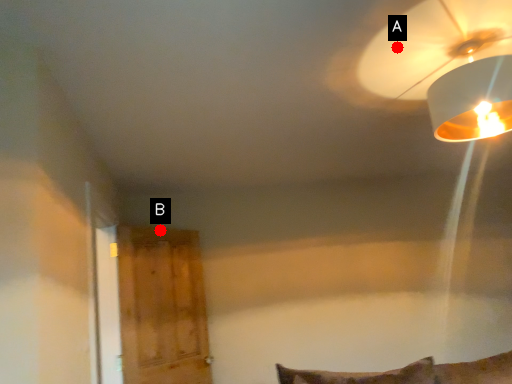
Question: Two points are circled on the image, labeled by A and B beside each circle. Which point is closer to the camera taking this photo?

Choices:
 (A) A is closer
 (B) B is closer

Answer: (A)